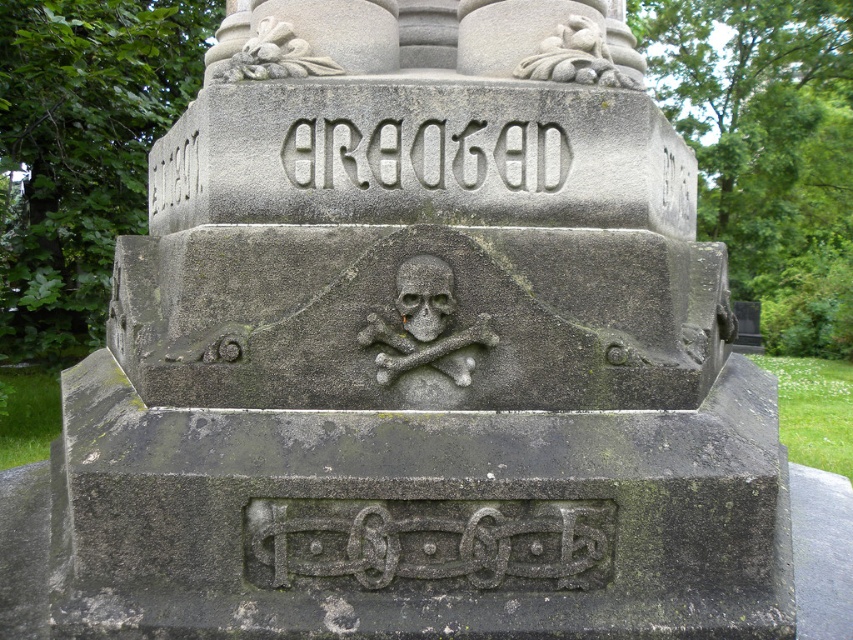
Between point (569, 17) and point (292, 64), which one is positioned in front?

Point (292, 64) is more forward.

Is smooth stone grapes at upper center smaller than carved stone ornament at upper center?

Yes, smooth stone grapes at upper center is smaller than carved stone ornament at upper center.

Find the location of a particular element. Image resolution: width=853 pixels, height=640 pixels. smooth stone grapes at upper center is located at coordinates (584, 56).

Does white stone lettering at center have a lesser height compared to smooth stone grapes at upper center?

Indeed, white stone lettering at center has a lesser height compared to smooth stone grapes at upper center.

Based on the photo, measure the distance between point (299,148) and camera.

The distance of point (299,148) from camera is 10.21 feet.

Image resolution: width=853 pixels, height=640 pixels. I want to click on white stone lettering at center, so click(425, 154).

Is carved stone skull and crossbones at center bigger than smooth stone grapes at upper center?

Actually, carved stone skull and crossbones at center might be smaller than smooth stone grapes at upper center.

Does carved stone skull and crossbones at center lie in front of smooth stone grapes at upper center?

Yes, it is.

Does point (430, 253) lie in front of point (538, 67)?

That is True.

Find the location of a particular element. This screenshot has height=640, width=853. carved stone skull and crossbones at center is located at coordinates (425, 324).